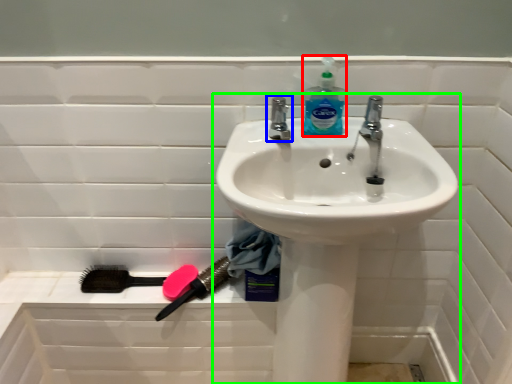
Question: Based on their relative distances, which object is nearer to cleaning product (highlighted by a red box)? Choose from tap (highlighted by a blue box) and sink (highlighted by a green box).

Choices:
 (A) tap
 (B) sink

Answer: (A)